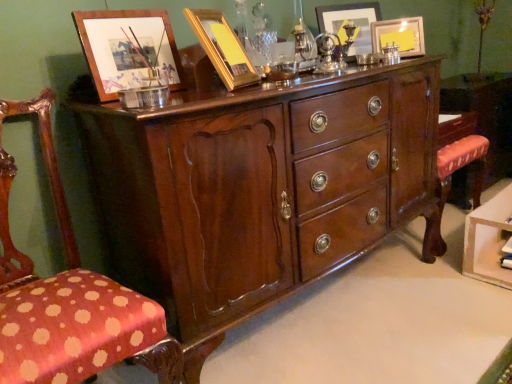
Where is `vacant region under shiny brown wood chest of drawers at center (from a real-world perspective)`? This screenshot has width=512, height=384. vacant region under shiny brown wood chest of drawers at center (from a real-world perspective) is located at coordinates pyautogui.click(x=305, y=316).